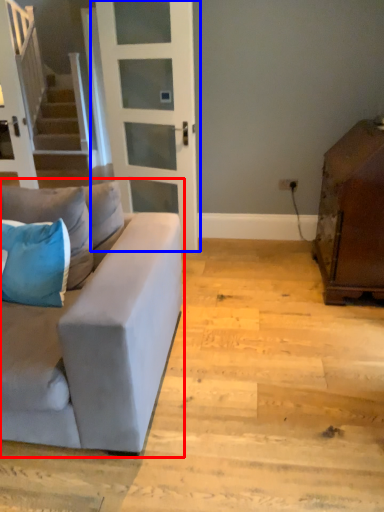
Question: Among these objects, which one is nearest to the camera, studio couch (highlighted by a red box) or door (highlighted by a blue box)?

Choices:
 (A) studio couch
 (B) door

Answer: (A)